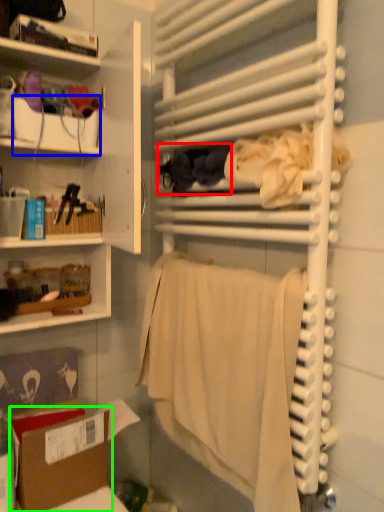
Question: Estimate the real-world distances between objects in this image. Which object is farther from clothing (highlighted by a red box), box (highlighted by a blue box) or cardboard box (highlighted by a green box)?

Choices:
 (A) box
 (B) cardboard box

Answer: (B)